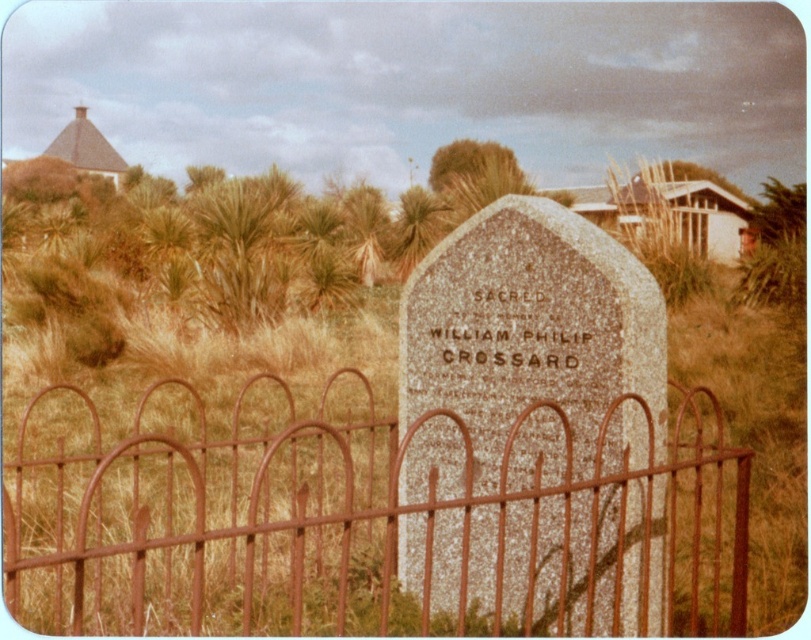
You are standing in front of the gravestone and want to place two markers at coordinates point (500, 499) and point (475, 552). Which marker will be closer to you?

Point (500, 499) is closer to the viewer than point (475, 552).

You are a landscape architect planning to install a new pathway near the rusty metal fence at center and the granite gravestone at center. Based on their sizes, which object would require more space for the pathway to avoid encroaching on its area?

The granite gravestone at center requires more space because it occupies more area than the rusty metal fence at center, according to the description.